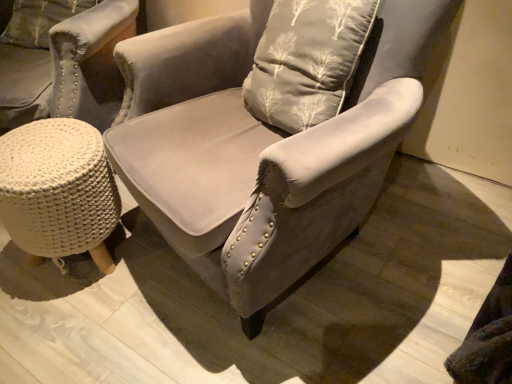
Question: Is suede gray armchair at center wider than velvet gray pillow with tree pattern at upper left?

Choices:
 (A) yes
 (B) no

Answer: (A)

Question: Does suede gray armchair at center have a lesser width compared to velvet gray pillow with tree pattern at upper left?

Choices:
 (A) no
 (B) yes

Answer: (A)

Question: From the image's perspective, is suede gray armchair at center on top of velvet gray pillow with tree pattern at upper left?

Choices:
 (A) no
 (B) yes

Answer: (A)

Question: Considering the relative sizes of suede gray armchair at center and velvet gray pillow with tree pattern at upper left in the image provided, is suede gray armchair at center bigger than velvet gray pillow with tree pattern at upper left?

Choices:
 (A) no
 (B) yes

Answer: (B)

Question: Is the depth of suede gray armchair at center greater than that of velvet gray pillow with tree pattern at upper left?

Choices:
 (A) no
 (B) yes

Answer: (A)

Question: From a real-world perspective, is suede gray armchair at center beneath velvet gray pillow with tree pattern at upper left?

Choices:
 (A) no
 (B) yes

Answer: (B)

Question: Does velvet gray pillow with tree pattern at upper left have a lesser height compared to white knitted stool at lower left?

Choices:
 (A) yes
 (B) no

Answer: (A)

Question: Considering the relative positions of velvet gray pillow with tree pattern at upper left and white knitted stool at lower left in the image provided, is velvet gray pillow with tree pattern at upper left to the right of white knitted stool at lower left from the viewer's perspective?

Choices:
 (A) no
 (B) yes

Answer: (A)

Question: Is velvet gray pillow with tree pattern at upper left closer to camera compared to white knitted stool at lower left?

Choices:
 (A) no
 (B) yes

Answer: (A)

Question: Is velvet gray pillow with tree pattern at upper left positioned with its back to white knitted stool at lower left?

Choices:
 (A) yes
 (B) no

Answer: (B)

Question: Is velvet gray pillow with tree pattern at upper left wider than white knitted stool at lower left?

Choices:
 (A) no
 (B) yes

Answer: (A)

Question: From a real-world perspective, is velvet gray pillow with tree pattern at upper left located beneath white knitted stool at lower left?

Choices:
 (A) no
 (B) yes

Answer: (A)

Question: Are white knitted stool at lower left and velvet gray pillow with tree pattern at upper left located far from each other?

Choices:
 (A) yes
 (B) no

Answer: (B)